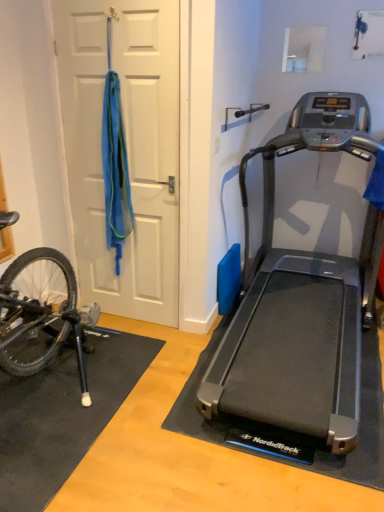
Where is `vacant area that is in front of white matte door at left`? vacant area that is in front of white matte door at left is located at coordinates (141, 341).